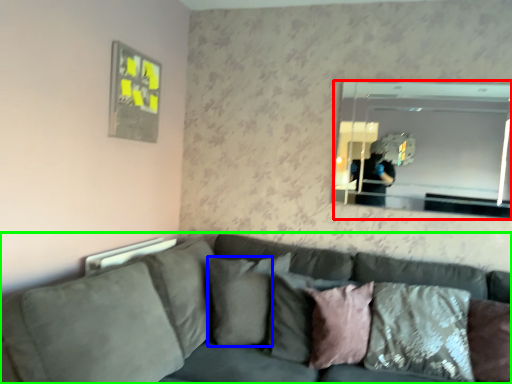
Question: Based on their relative distances, which object is nearer to mirror (highlighted by a red box)? Choose from pillow (highlighted by a blue box) and studio couch (highlighted by a green box).

Choices:
 (A) pillow
 (B) studio couch

Answer: (B)